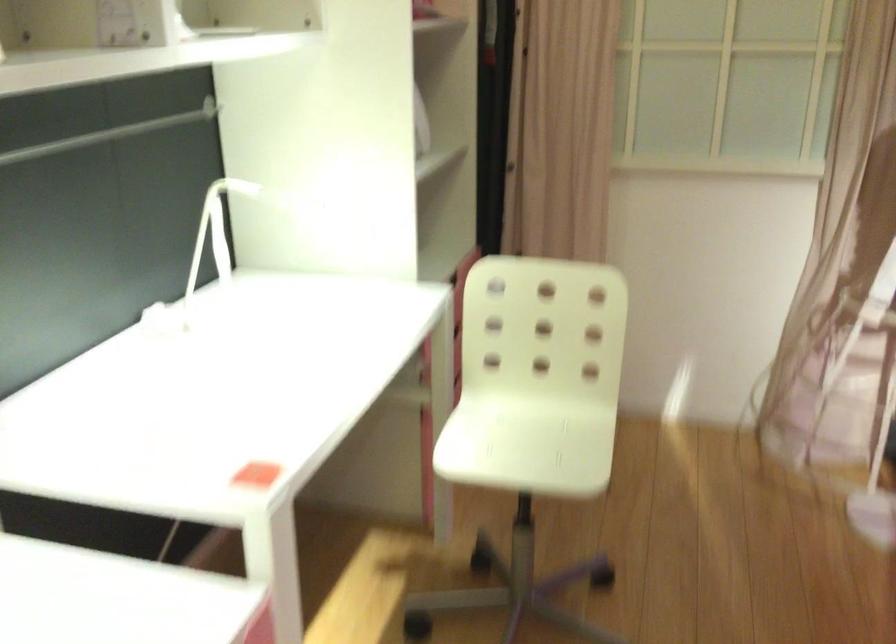
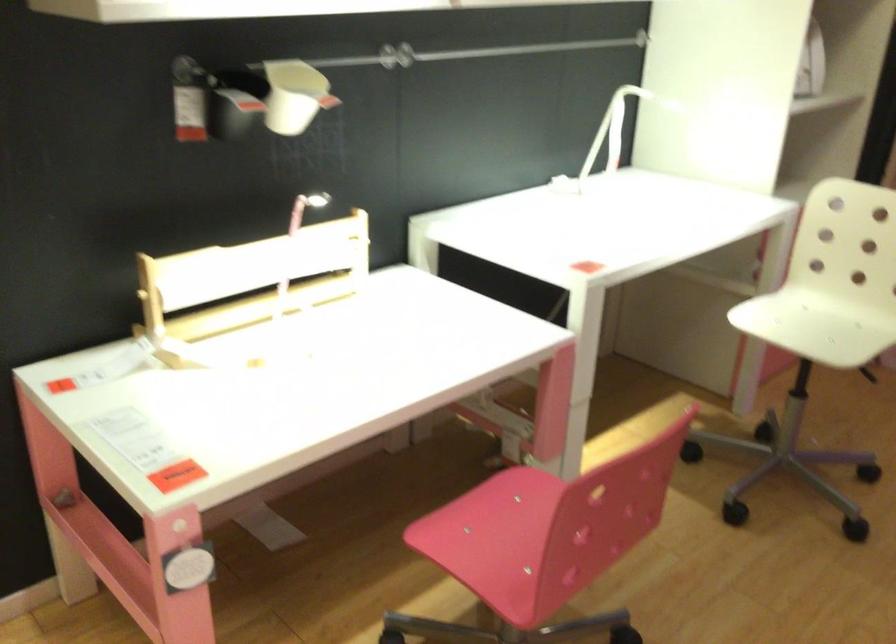
In the second image, find the point that corresponds to (x=234, y=234) in the first image.

(618, 126)